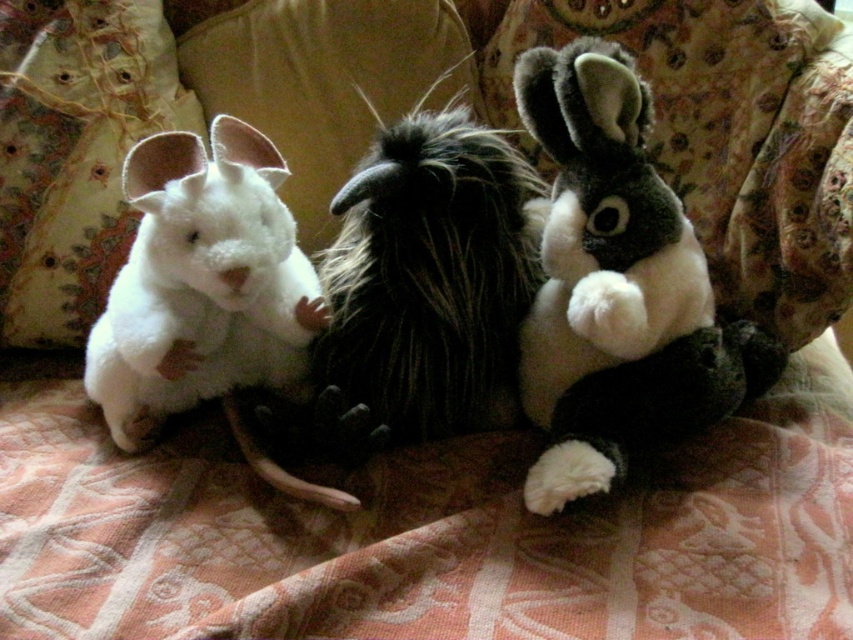
Question: Does white plush rabbit at left appear over white plush pillow at left?

Choices:
 (A) yes
 (B) no

Answer: (B)

Question: Which of the following is the closest to the observer?

Choices:
 (A) fluffy black and white plush at center
 (B) white plush rabbit at left
 (C) fluffy white and black plush rabbit at center
 (D) white plush pillow at left

Answer: (C)

Question: Can you confirm if white plush rabbit at left is smaller than white plush pillow at left?

Choices:
 (A) yes
 (B) no

Answer: (B)

Question: Which is farther from the fluffy black and white plush at center?

Choices:
 (A) fluffy white and black plush rabbit at center
 (B) white plush pillow at left

Answer: (B)

Question: Does white plush rabbit at left have a greater width compared to white plush pillow at left?

Choices:
 (A) yes
 (B) no

Answer: (A)

Question: Which object is farther from the camera taking this photo?

Choices:
 (A) white plush pillow at left
 (B) fluffy white and black plush rabbit at center
 (C) fluffy black and white plush at center

Answer: (A)